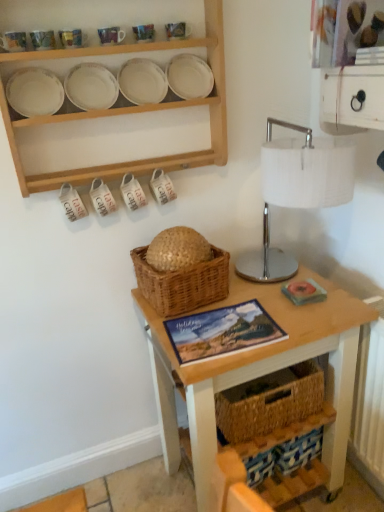
This screenshot has height=512, width=384. Identify the location of free area below matte paper book at center (from a real-world perspective). (220, 332).